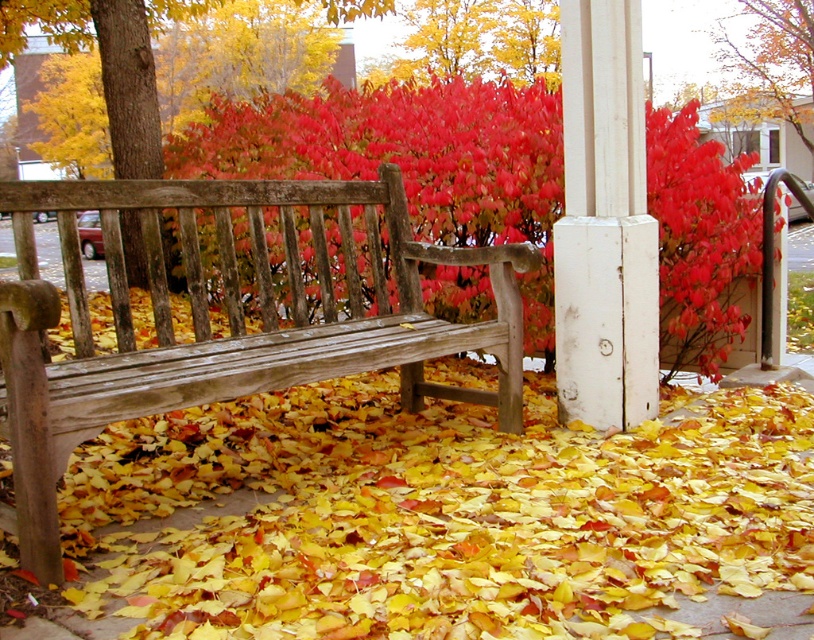
Between white painted wood post at center and smooth red leaves at upper center, which one has more height?

smooth red leaves at upper center is taller.

Is point (580, 339) farther from viewer compared to point (427, 44)?

No, it is not.

Which is in front, point (607, 115) or point (539, 1)?

Point (607, 115)

Where is `white painted wood post at center`? white painted wood post at center is located at coordinates (604, 224).

Between wooden bench at center and vivid red leaves at center, which one appears on the right side from the viewer's perspective?

From the viewer's perspective, vivid red leaves at center appears more on the right side.

Does wooden bench at center have a greater width compared to vivid red leaves at center?

Incorrect, wooden bench at center's width does not surpass vivid red leaves at center's.

The width and height of the screenshot is (814, 640). Identify the location of wooden bench at center. (226, 317).

Does yellow wood bench at center have a lesser height compared to wooden bench at center?

Correct, yellow wood bench at center is not as tall as wooden bench at center.

Which is above, yellow wood bench at center or wooden bench at center?

wooden bench at center is above.

Describe the element at coordinates (449, 515) in the screenshot. Image resolution: width=814 pixels, height=640 pixels. I see `yellow wood bench at center` at that location.

What are the coordinates of `yellow wood bench at center` in the screenshot? It's located at (449, 515).